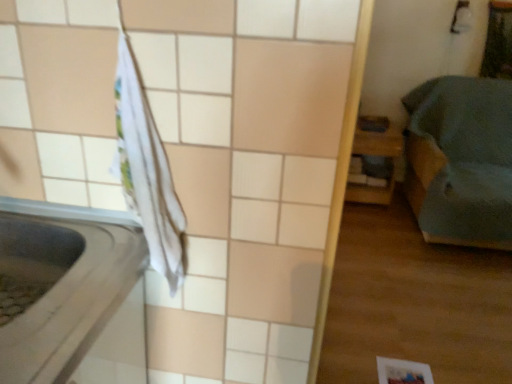
Question: Is white matte paper at lower right to the left of white fabric at left from the viewer's perspective?

Choices:
 (A) no
 (B) yes

Answer: (A)

Question: Is white fabric at left at the back of white matte paper at lower right?

Choices:
 (A) no
 (B) yes

Answer: (A)

Question: Does white matte paper at lower right have a lesser width compared to white fabric at left?

Choices:
 (A) yes
 (B) no

Answer: (A)

Question: From a real-world perspective, is white matte paper at lower right beneath white fabric at left?

Choices:
 (A) yes
 (B) no

Answer: (A)

Question: From the image's perspective, is white matte paper at lower right located above white fabric at left?

Choices:
 (A) no
 (B) yes

Answer: (A)

Question: Considering the relative sizes of white matte paper at lower right and white fabric at left in the image provided, is white matte paper at lower right taller than white fabric at left?

Choices:
 (A) yes
 (B) no

Answer: (B)

Question: Can you confirm if teal fabric bed at right, the 1th furniture positioned from the right, is smaller than white fabric at left?

Choices:
 (A) no
 (B) yes

Answer: (A)

Question: Is teal fabric bed at right, positioned as the second furniture in left-to-right order, not close to white fabric at left?

Choices:
 (A) no
 (B) yes

Answer: (B)

Question: Is teal fabric bed at right, the 1th furniture positioned from the right, at the right side of white fabric at left?

Choices:
 (A) yes
 (B) no

Answer: (A)

Question: From the image's perspective, would you say teal fabric bed at right, positioned as the second furniture in left-to-right order, is positioned over white fabric at left?

Choices:
 (A) no
 (B) yes

Answer: (B)

Question: Is teal fabric bed at right, positioned as the second furniture in left-to-right order, shorter than white fabric at left?

Choices:
 (A) yes
 (B) no

Answer: (B)

Question: From the image's perspective, is teal fabric bed at right, positioned as the second furniture in left-to-right order, under white fabric at left?

Choices:
 (A) yes
 (B) no

Answer: (B)

Question: Does white fabric at left touch teal fabric bed at right, positioned as the second furniture in left-to-right order?

Choices:
 (A) no
 (B) yes

Answer: (A)